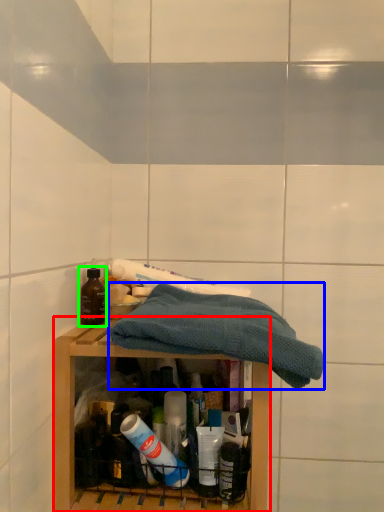
Question: Which object is the farthest from shelf (highlighted by a red box)? Choose among these: towel (highlighted by a blue box) or bottle (highlighted by a green box).

Choices:
 (A) towel
 (B) bottle

Answer: (B)